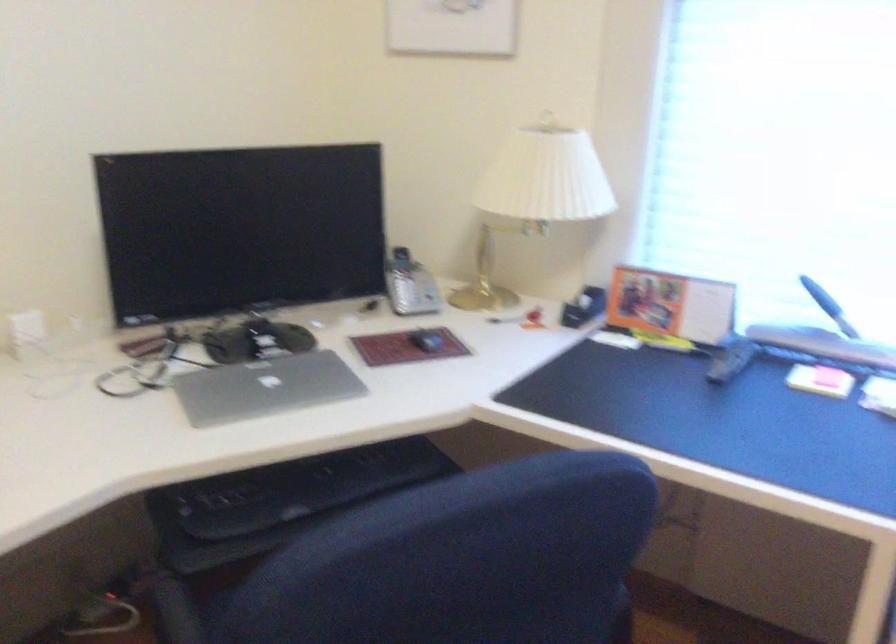
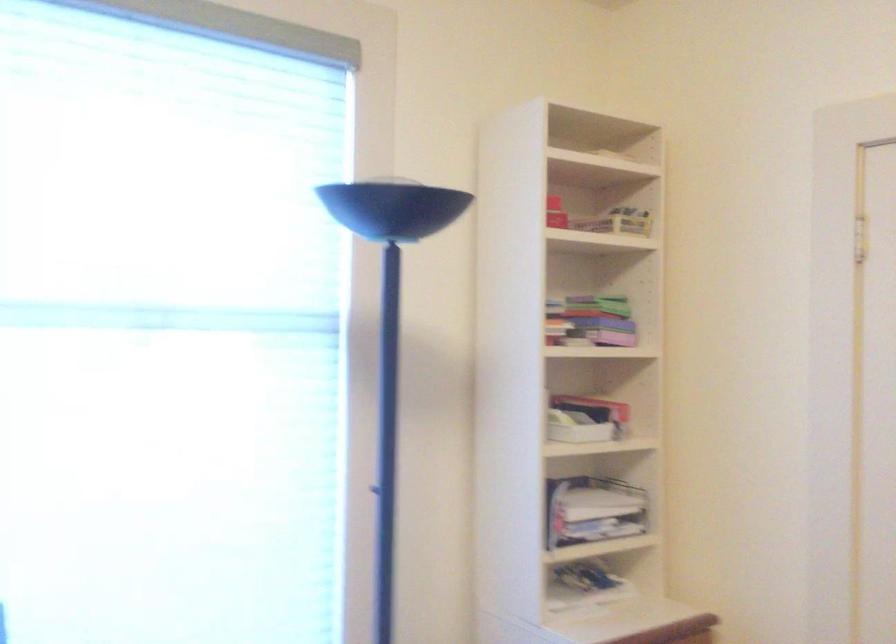
Question: The camera is either moving clockwise (left) or counter-clockwise (right) around the object. The first image is from the beginning of the video and the second image is from the end. Is the camera moving left or right when shooting the video?

Choices:
 (A) Left
 (B) Right

Answer: (A)